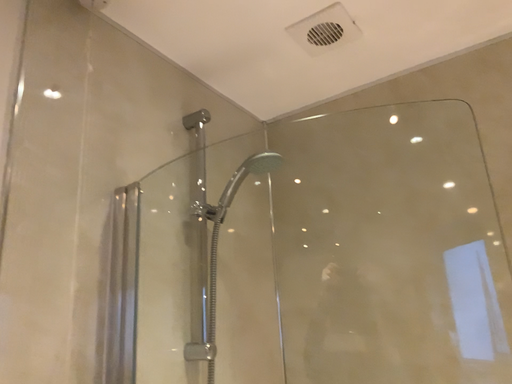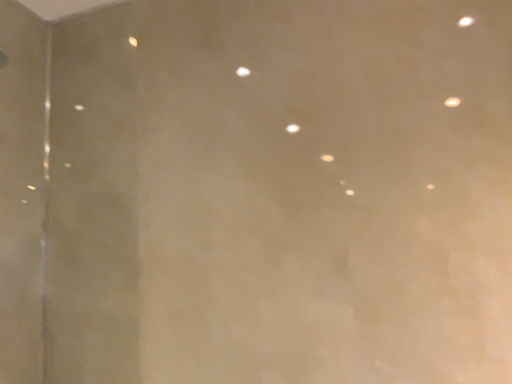
Question: Which way did the camera rotate in the video?

Choices:
 (A) rotated right
 (B) rotated left

Answer: (A)